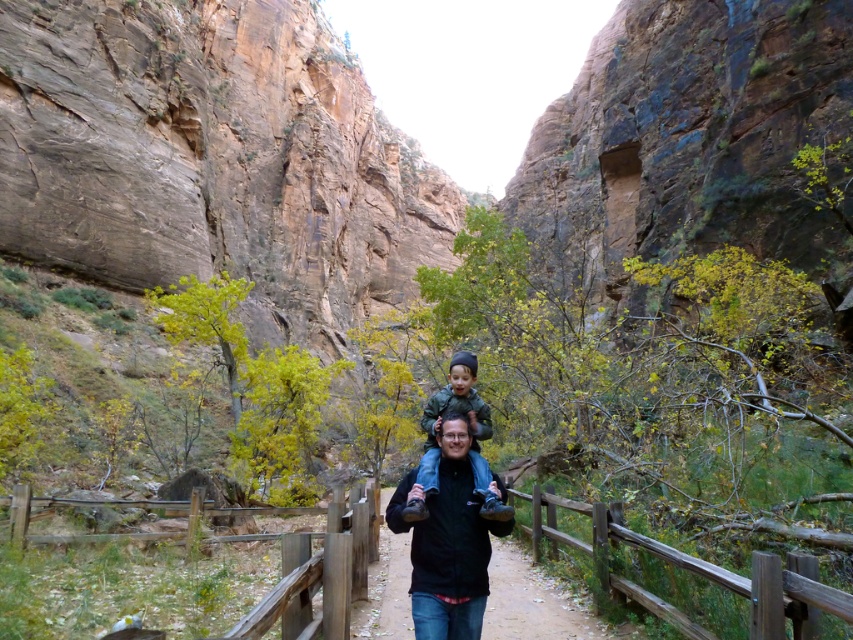
You are standing on the wooden pathway in the canyon and see two jackets hanging on the railings. The black matte jacket at center and the green fabric jacket at center. Which jacket is closer to you?

The black matte jacket at center is closer to you because it is in front of the green fabric jacket at center.

You are a hiker who wants to ensure they can see the canyon walls clearly while walking on the brown wooden trail at center. Considering the black matte jacket at center is in your path, will the jacket obstruct your view of the canyon walls?

The black matte jacket at center is taller than the brown wooden trail at center, so it may obstruct your view of the canyon walls while walking on the trail.